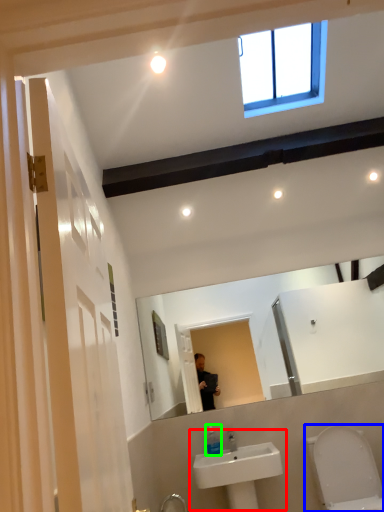
Question: Based on their relative distances, which object is nearer to sink (highlighted by a red box)? Choose from toilet (highlighted by a blue box) and soap dispenser (highlighted by a green box).

Choices:
 (A) toilet
 (B) soap dispenser

Answer: (B)